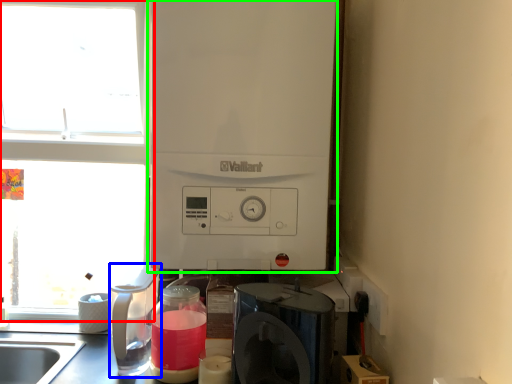
Question: Which object is positioned closest to window (highlighted by a red box)? Select from kitchen appliance (highlighted by a blue box) and appliance (highlighted by a green box).

Choices:
 (A) kitchen appliance
 (B) appliance

Answer: (A)